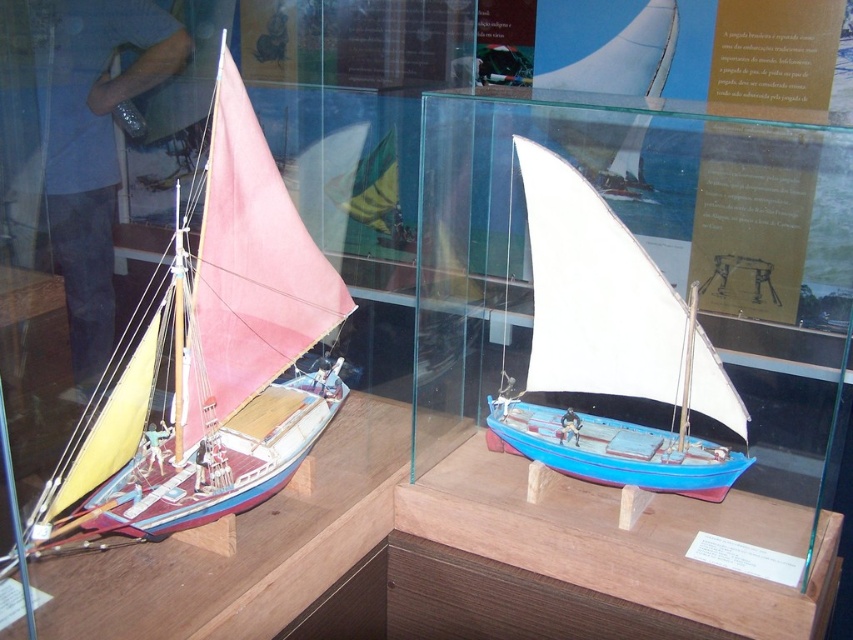
You are an art curator examining the miniature sailboats in the glass case. You need to determine if the matte pink sail at left can be moved closer to the white matte sailboat at center without overlapping. Based on their widths, can they be positioned side by side within the case?

The matte pink sail at left is wider than the white matte sailboat at center. Since their combined widths would exceed the available space in the case, they cannot be positioned side by side without overlapping.

You are a museum curator planning to move the white matte sailboat at center closer to the matte pink sail at left for an exhibition. The display case allows for a minimum of 20 inches between objects for safety. Is the current distance sufficient for moving them closer without violating the safety requirement?

The current distance between the matte pink sail at left and the white matte sailboat at center is 22.51 inches, which is greater than the minimum required 20 inches. Therefore, moving them closer would still maintain the safety requirement as long as the new distance remains above 20 inches.

You are a museum visitor observing the miniature sailboats in the glass case. You notice the matte pink sail at left and the white matte sailboat at center. Which object is located to the left of the other?

The matte pink sail at left is positioned on the left side of the white matte sailboat at center.